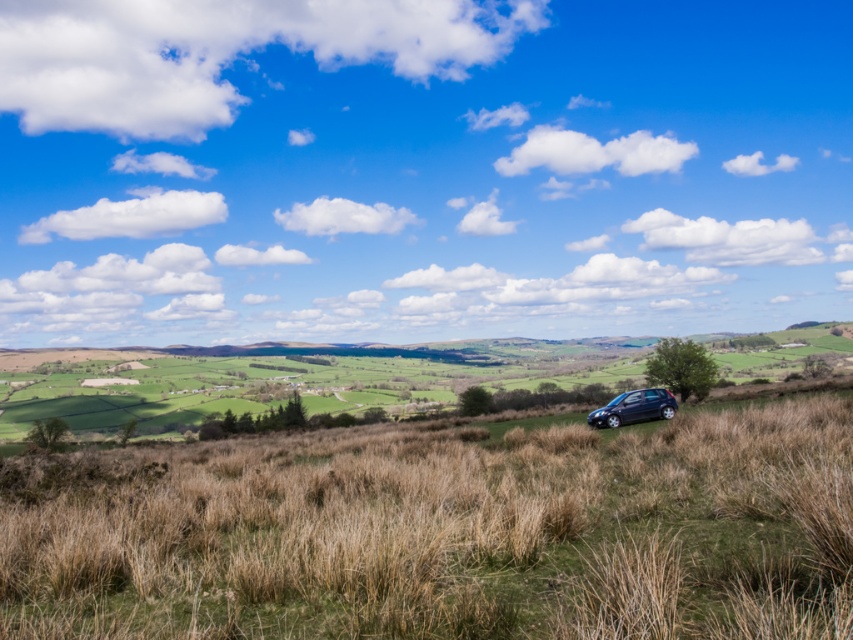
You are standing in the rural landscape and want to walk from the dry grass at lower right to the glossy metallic car at lower right. Which direction should you move relative to the car?

You should move to the right relative to the glossy metallic car at lower right because the dry grass at lower right is positioned on the left side of the car.

You are standing in the rural landscape and want to take a photo of the dry grass at lower right and the glossy metallic car at lower right. Which object should you focus on first if you want both to be in clear focus?

You should focus on the dry grass at lower right first because it is closer to the viewer than the glossy metallic car at lower right, so adjusting focus from near to far will help both be in clear focus.

You are standing in the rural landscape and want to take a photo of the glossy metallic car at lower right. Since the dry grass at lower right is blocking your view, where should you move to get a clear shot?

The dry grass at lower right is above the glossy metallic car at lower right, so you should move to a lower position to get a clear view of the car by bending down or moving closer to the ground level.